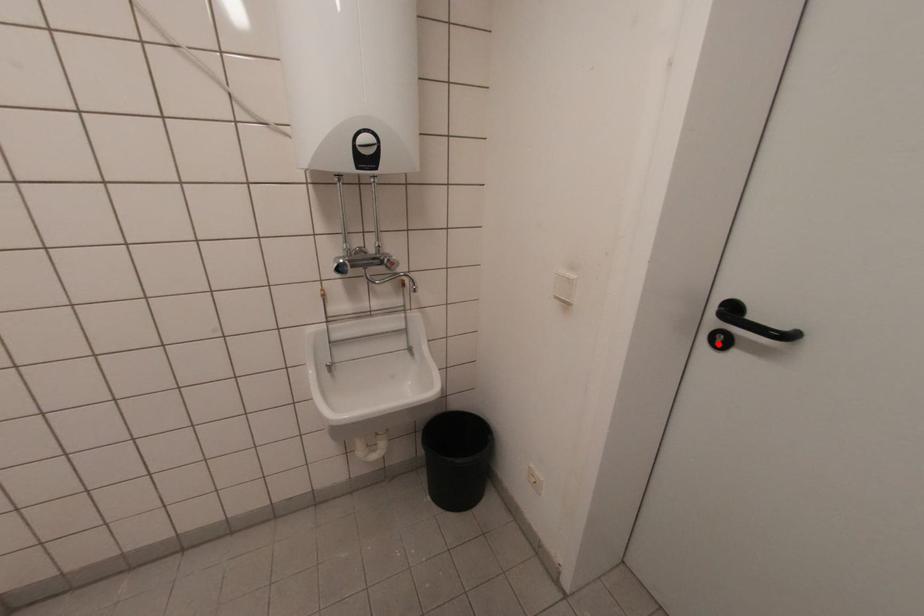
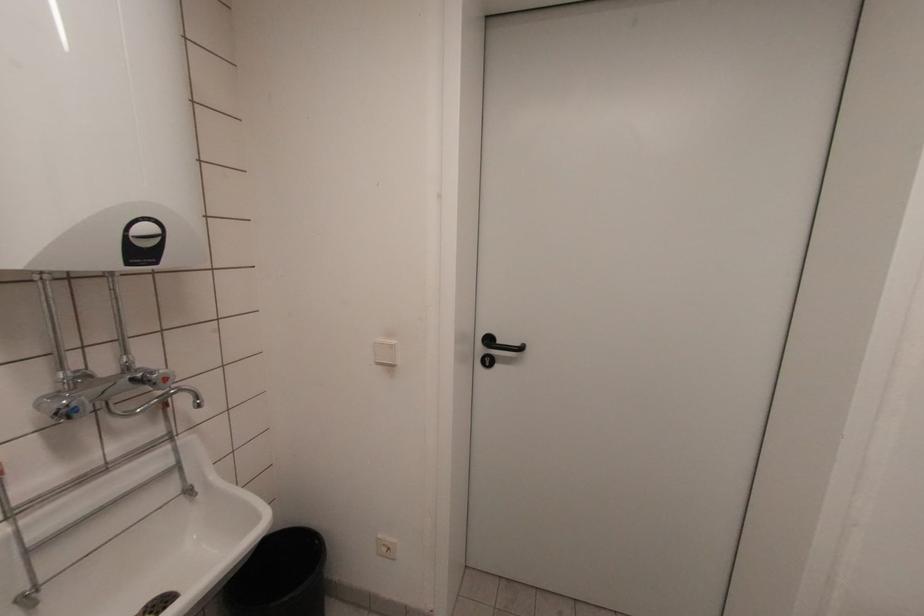
Find the pixel in the second image that matches the highlighted location in the first image.

(488, 363)